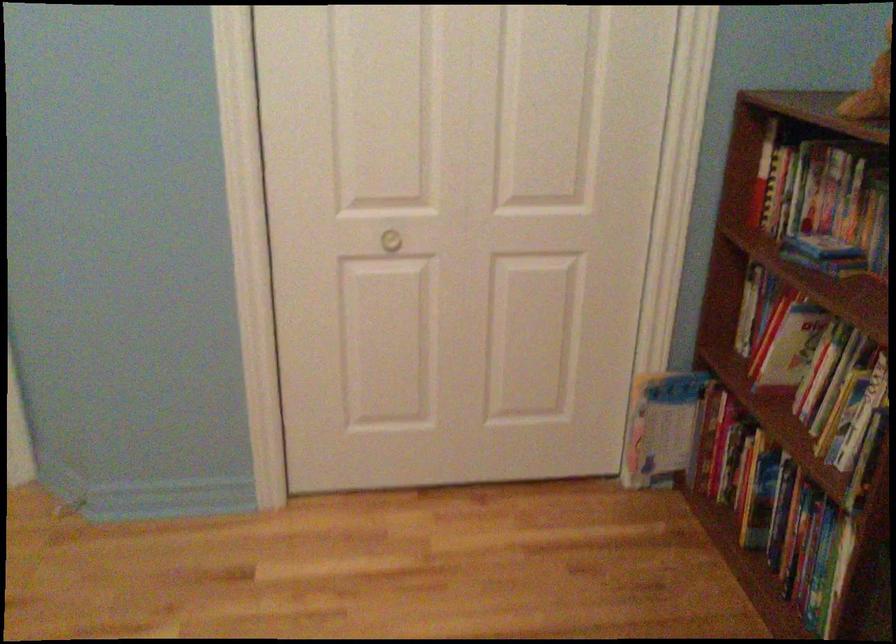
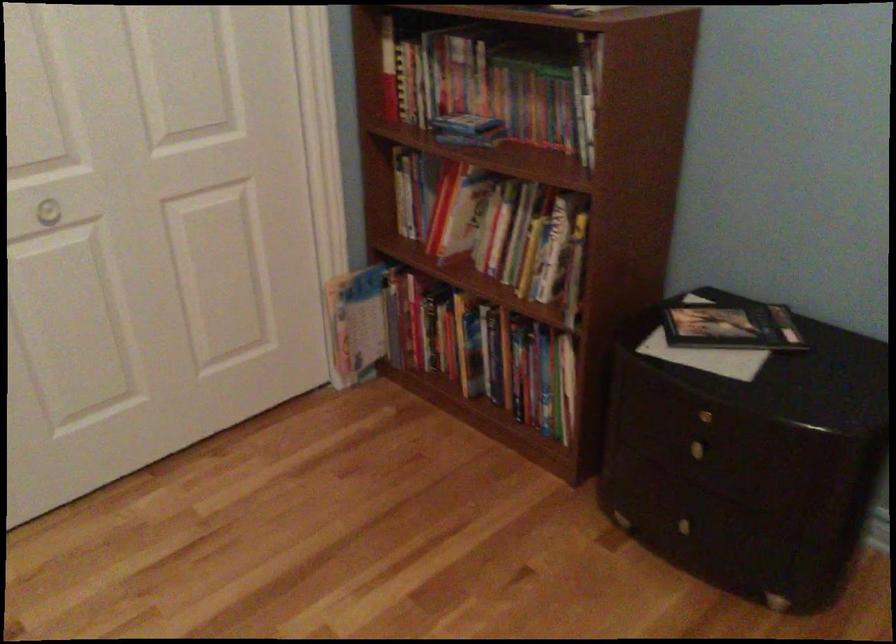
Locate, in the second image, the point that corresponds to pixel 392 240 in the first image.

(47, 212)